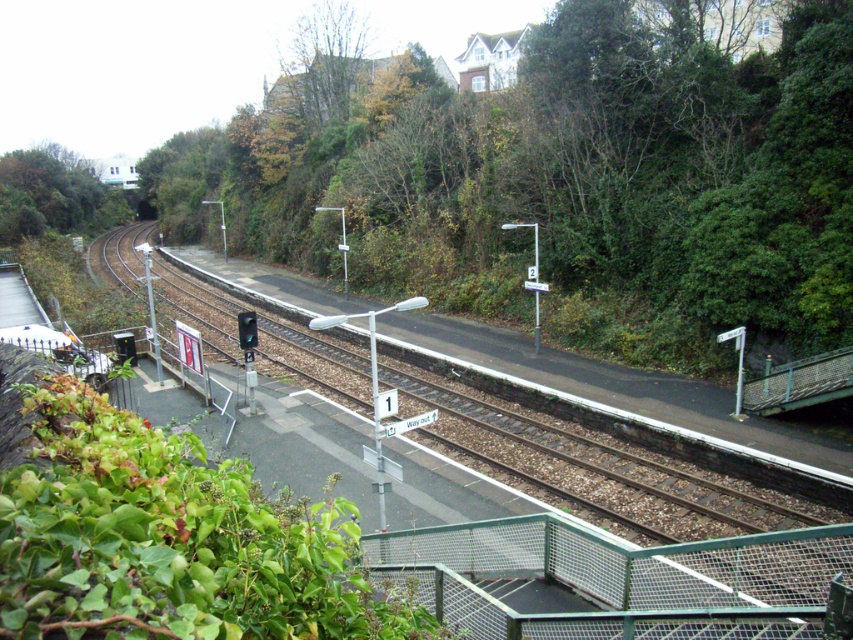
Question: Which point is farther from the camera taking this photo?

Choices:
 (A) (727, 515)
 (B) (117, 198)

Answer: (B)

Question: Which point is closer to the camera?

Choices:
 (A) (357, 76)
 (B) (701, 362)
 (C) (606, 516)

Answer: (C)

Question: Which point is farther from the camera taking this photo?

Choices:
 (A) (115, 212)
 (B) (247, 333)
 (C) (270, 115)
 (D) (251, 131)

Answer: (A)

Question: Does green leafy tree at center come in front of green leafy tree at upper left?

Choices:
 (A) no
 (B) yes

Answer: (B)

Question: Is green leafy tree at upper center to the right of green glass traffic light at lower left from the viewer's perspective?

Choices:
 (A) no
 (B) yes

Answer: (A)

Question: Is green leafy tree at upper center wider than green leafy tree at upper left?

Choices:
 (A) yes
 (B) no

Answer: (B)